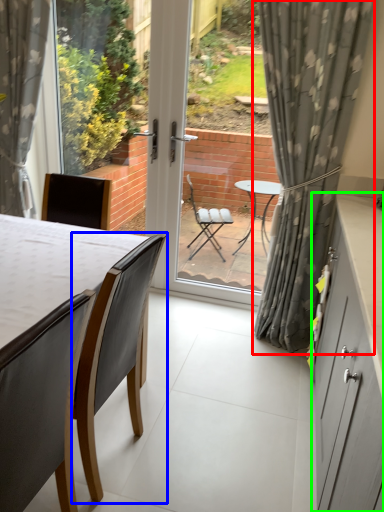
Question: Which object is the closest to the curtain (highlighted by a red box)? Choose among these: chair (highlighted by a blue box) or cabinetry (highlighted by a green box).

Choices:
 (A) chair
 (B) cabinetry

Answer: (B)